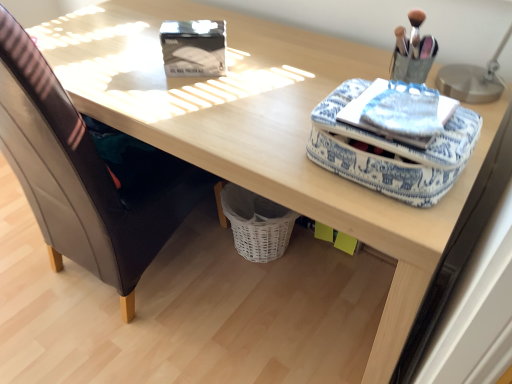
This screenshot has height=384, width=512. Identify the location of vacant space that is to the left of matte black storage box at upper center. (124, 66).